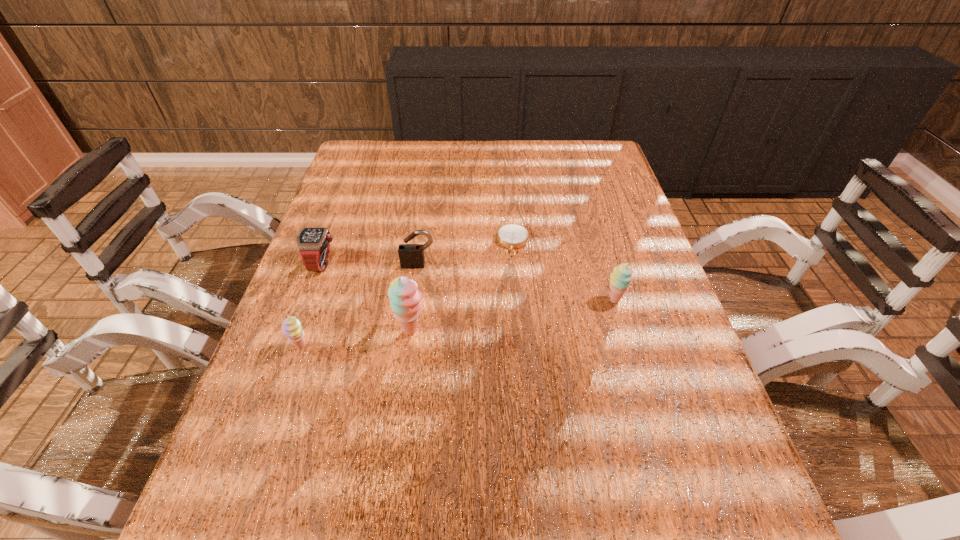
Where is `spot to insert another sherbert for uniform distribution`? spot to insert another sherbert for uniform distribution is located at coordinates (516, 315).